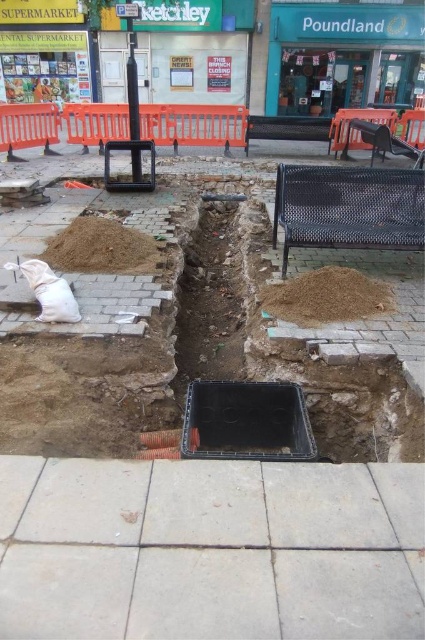
Question: Estimate the real-world distances between objects in this image. Which object is farther from the brown dirt at left?

Choices:
 (A) gray concrete pavement at center
 (B) brown sand at lower right

Answer: (A)

Question: Does gray concrete pavement at center appear on the right side of brown sand at lower right?

Choices:
 (A) yes
 (B) no

Answer: (B)

Question: Can you confirm if gray concrete pavement at center is thinner than brown sand at lower right?

Choices:
 (A) no
 (B) yes

Answer: (A)

Question: Considering the real-world distances, which object is farthest from the brown sand at lower right?

Choices:
 (A) brown dirt at left
 (B) gray concrete pavement at center

Answer: (B)

Question: Is brown sand at lower right to the right of brown dirt at left from the viewer's perspective?

Choices:
 (A) yes
 (B) no

Answer: (A)

Question: Based on their relative distances, which object is nearer to the brown dirt at left?

Choices:
 (A) gray concrete pavement at center
 (B) brown sand at lower right

Answer: (B)